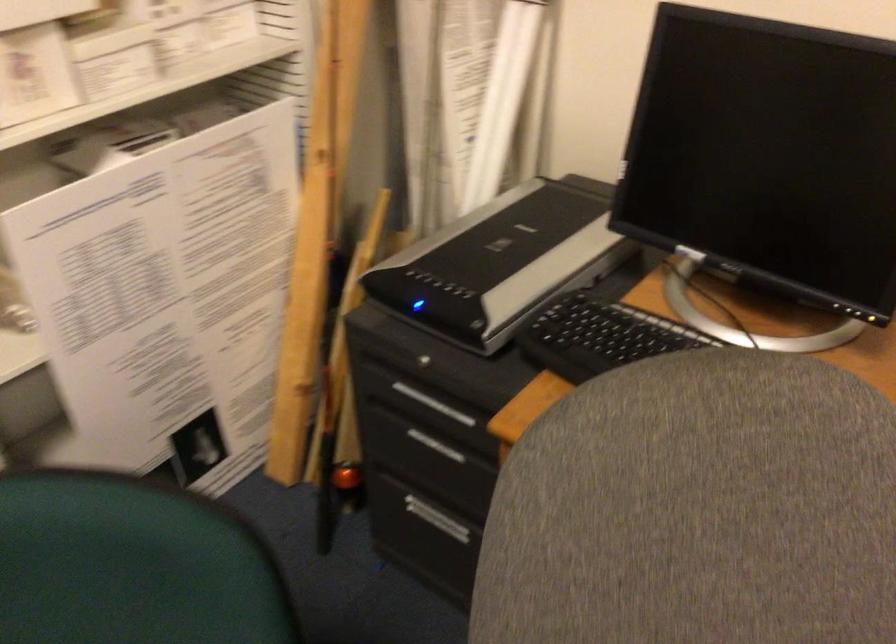
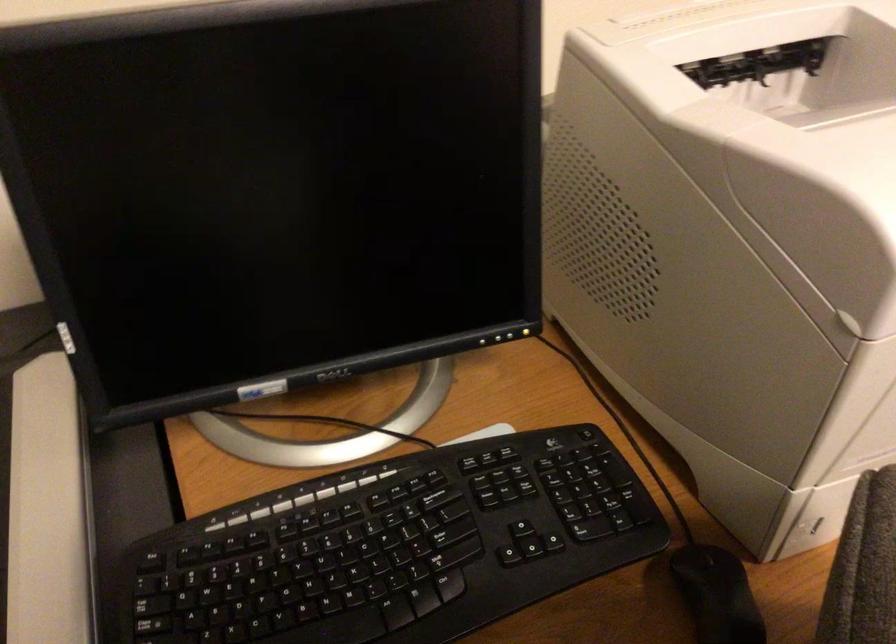
Where in the second image is the point corresponding to (629,348) from the first image?

(311, 585)